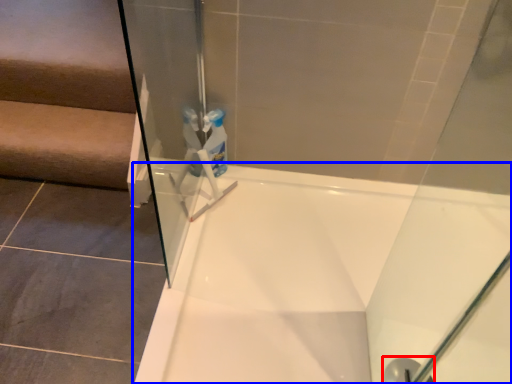
Question: Which of the following is the closest to the observer, shower (highlighted by a red box) or bathtub (highlighted by a blue box)?

Choices:
 (A) shower
 (B) bathtub

Answer: (B)